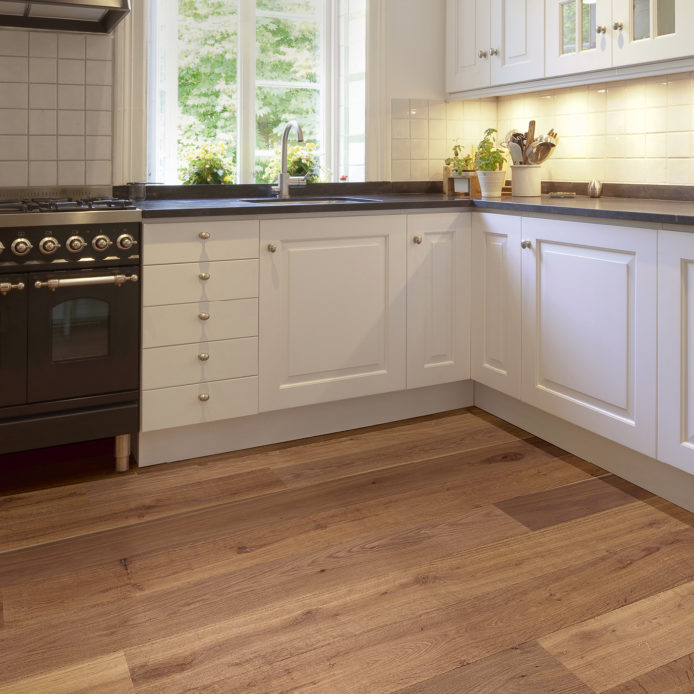
I want to click on cupboard, so click(332, 310), click(443, 327), click(489, 325), click(559, 327), click(672, 375), click(636, 42), click(568, 53), click(518, 57), click(463, 73).